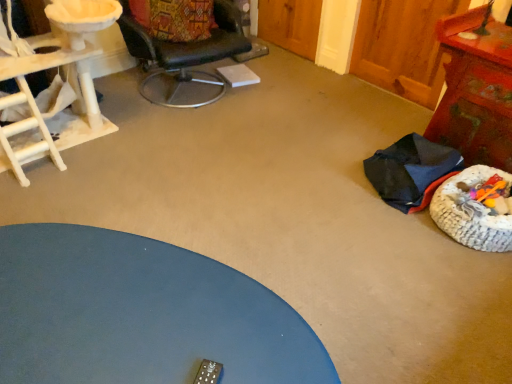
Question: Is blue matte table at lower left, which appears as the 1th table when viewed from the front, located within dark blue fabric chair at lower right, the second chair when ordered from top to bottom?

Choices:
 (A) no
 (B) yes

Answer: (A)

Question: Does dark blue fabric chair at lower right, marked as the first chair in a right-to-left arrangement, appear on the left side of blue matte table at lower left, the 2th table viewed from the back?

Choices:
 (A) no
 (B) yes

Answer: (A)

Question: Does dark blue fabric chair at lower right, the first chair when ordered from bottom to top, appear on the right side of blue matte table at lower left, which is the second table from right to left?

Choices:
 (A) yes
 (B) no

Answer: (A)

Question: Can you confirm if dark blue fabric chair at lower right, which is the second chair in left-to-right order, is bigger than blue matte table at lower left, arranged as the 1th table when ordered from the bottom?

Choices:
 (A) no
 (B) yes

Answer: (A)

Question: From the image's perspective, is dark blue fabric chair at lower right, marked as the first chair in a right-to-left arrangement, located beneath blue matte table at lower left, the second table positioned from the top?

Choices:
 (A) yes
 (B) no

Answer: (B)

Question: Based on their sizes in the image, would you say white wood cat tree at left is bigger or smaller than blue matte table at lower left, the 2th table viewed from the back?

Choices:
 (A) small
 (B) big

Answer: (B)

Question: From a real-world perspective, is white wood cat tree at left above or below blue matte table at lower left, marked as the first table in a left-to-right arrangement?

Choices:
 (A) above
 (B) below

Answer: (A)

Question: From the image's perspective, is white wood cat tree at left positioned above or below blue matte table at lower left, marked as the first table in a left-to-right arrangement?

Choices:
 (A) above
 (B) below

Answer: (A)

Question: Is point (29, 157) positioned closer to the camera than point (54, 231)?

Choices:
 (A) farther
 (B) closer

Answer: (A)

Question: Is white wood cat tree at left situated inside black leather chair at upper center, the second chair when ordered from bottom to top, or outside?

Choices:
 (A) inside
 (B) outside

Answer: (B)

Question: Looking at their shapes, would you say white wood cat tree at left is wider or thinner than black leather chair at upper center, the second chair when ordered from bottom to top?

Choices:
 (A) thin
 (B) wide

Answer: (A)

Question: From the image's perspective, is white wood cat tree at left positioned above or below black leather chair at upper center, which ranks as the 1th chair in top-to-bottom order?

Choices:
 (A) below
 (B) above

Answer: (A)

Question: In terms of size, does white wood cat tree at left appear bigger or smaller than black leather chair at upper center, the second chair when ordered from bottom to top?

Choices:
 (A) small
 (B) big

Answer: (B)

Question: Choose the correct answer: Is black leather chair at upper center, the 1th chair from the left, inside wooden textured table at right, acting as the 2th table starting from the front, or outside it?

Choices:
 (A) inside
 (B) outside

Answer: (B)

Question: From a real-world perspective, is black leather chair at upper center, which ranks as the 1th chair in top-to-bottom order, positioned above or below wooden textured table at right, acting as the 2th table starting from the front?

Choices:
 (A) above
 (B) below

Answer: (A)